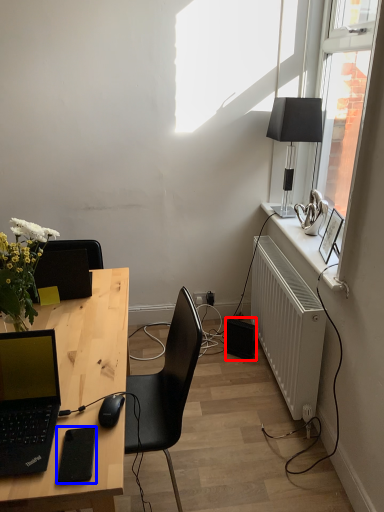
Question: Among these objects, which one is farthest to the camera, speaker (highlighted by a red box) or gadget (highlighted by a blue box)?

Choices:
 (A) speaker
 (B) gadget

Answer: (A)